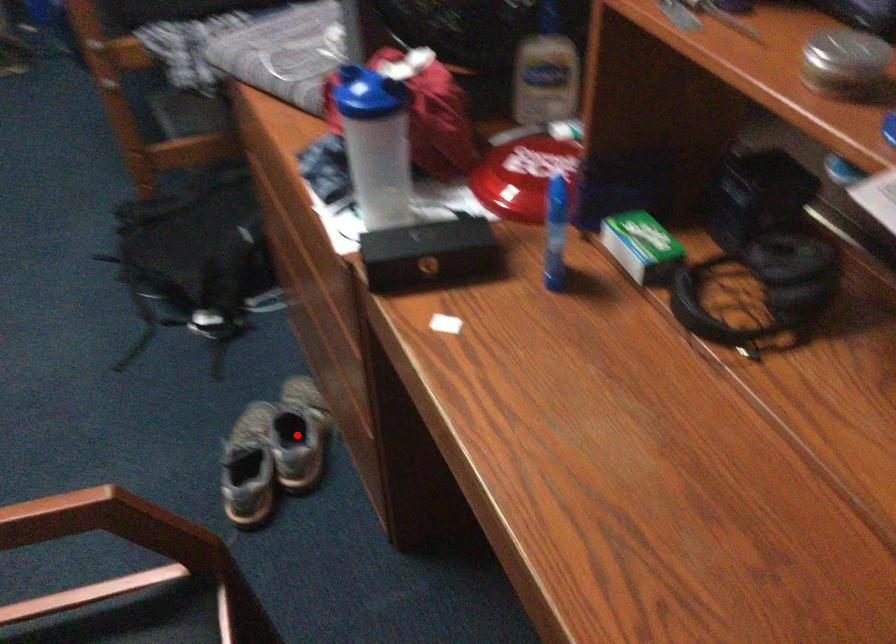
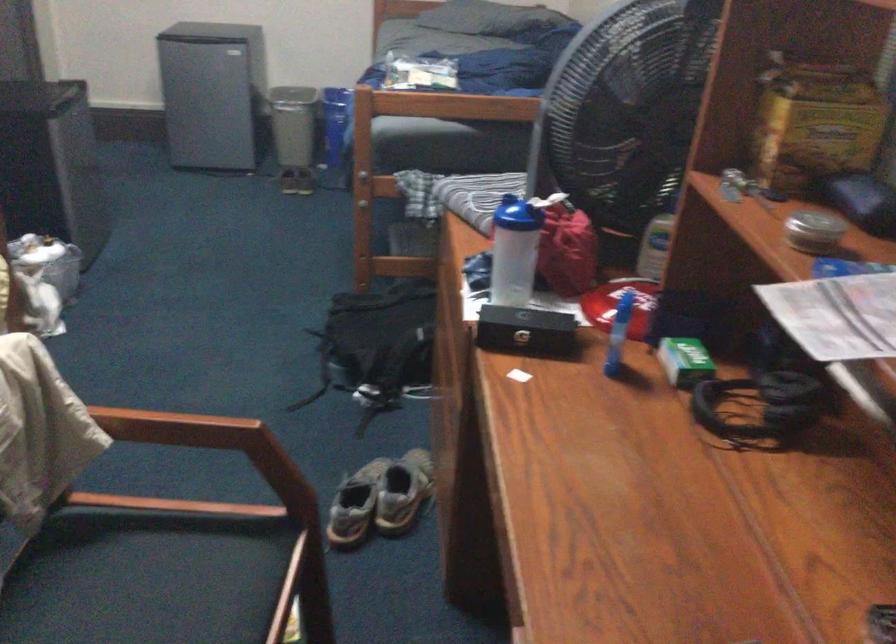
Question: I am providing you with two images of the same scene from different viewpoints. In image1, a red point is highlighted. Considering the same 3D point in image2, which of the following is correct?

Choices:
 (A) It is closer
 (B) It is farther

Answer: (B)